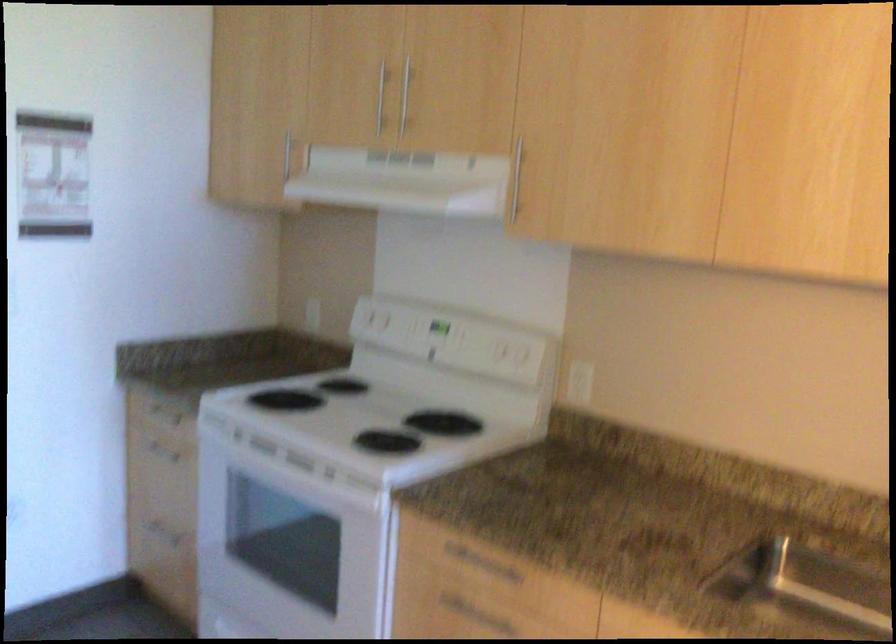
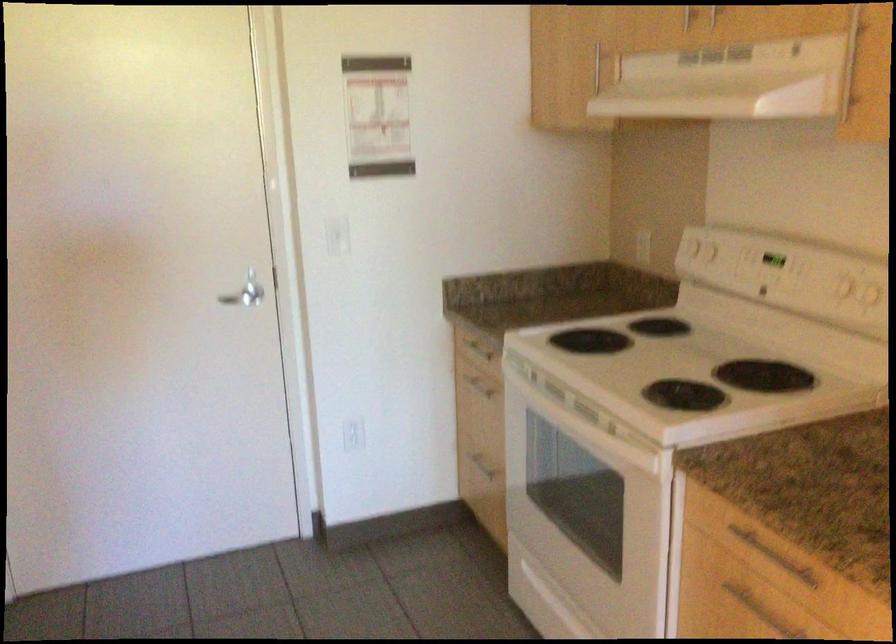
Where in the second image is the point corresponding to [160,453] from the first image?

(479, 384)